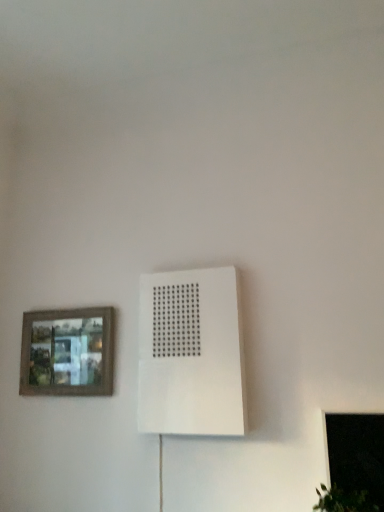
Question: Are transparent glass window at lower right and white matte air conditioning at center making contact?

Choices:
 (A) yes
 (B) no

Answer: (B)

Question: Does transparent glass window at lower right turn towards white matte air conditioning at center?

Choices:
 (A) yes
 (B) no

Answer: (B)

Question: Is transparent glass window at lower right at the left side of white matte air conditioning at center?

Choices:
 (A) yes
 (B) no

Answer: (B)

Question: Is transparent glass window at lower right thinner than white matte air conditioning at center?

Choices:
 (A) no
 (B) yes

Answer: (B)

Question: Is transparent glass window at lower right shorter than white matte air conditioning at center?

Choices:
 (A) yes
 (B) no

Answer: (A)

Question: From a real-world perspective, is transparent glass window at lower right positioned above or below white matte air conditioning at center?

Choices:
 (A) below
 (B) above

Answer: (A)

Question: From the image's perspective, is transparent glass window at lower right positioned above or below white matte air conditioning at center?

Choices:
 (A) below
 (B) above

Answer: (A)

Question: Based on their positions, is transparent glass window at lower right located to the left or right of white matte air conditioning at center?

Choices:
 (A) left
 (B) right

Answer: (B)

Question: In terms of width, does transparent glass window at lower right look wider or thinner when compared to white matte air conditioning at center?

Choices:
 (A) thin
 (B) wide

Answer: (A)

Question: Based on their sizes in the image, would you say white matte air conditioning at center is bigger or smaller than wooden framed picture at left?

Choices:
 (A) small
 (B) big

Answer: (B)

Question: Would you say white matte air conditioning at center is to the left or to the right of wooden framed picture at left in the picture?

Choices:
 (A) right
 (B) left

Answer: (A)

Question: In terms of width, does white matte air conditioning at center look wider or thinner when compared to wooden framed picture at left?

Choices:
 (A) wide
 (B) thin

Answer: (A)

Question: From the image's perspective, relative to wooden framed picture at left, is white matte air conditioning at center above or below?

Choices:
 (A) below
 (B) above

Answer: (B)

Question: From the image's perspective, is white matte air conditioning at center above or below transparent glass window at lower right?

Choices:
 (A) above
 (B) below

Answer: (A)

Question: In terms of width, does white matte air conditioning at center look wider or thinner when compared to transparent glass window at lower right?

Choices:
 (A) wide
 (B) thin

Answer: (A)